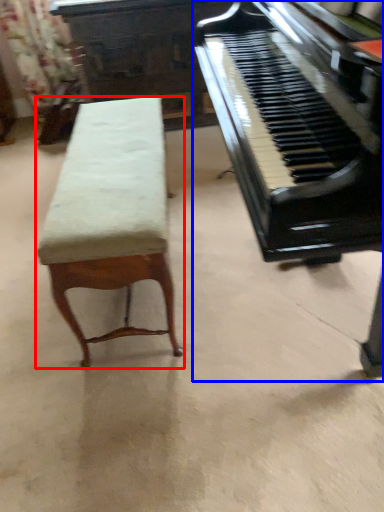
Question: Among these objects, which one is nearest to the camera, furniture (highlighted by a red box) or piano (highlighted by a blue box)?

Choices:
 (A) furniture
 (B) piano

Answer: (B)